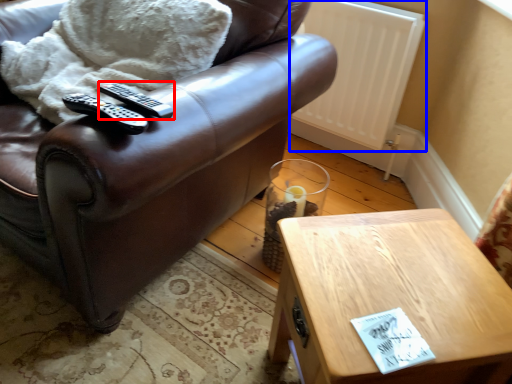
Question: Among these objects, which one is nearest to the camera, remote (highlighted by a red box) or radiator (highlighted by a blue box)?

Choices:
 (A) remote
 (B) radiator

Answer: (A)